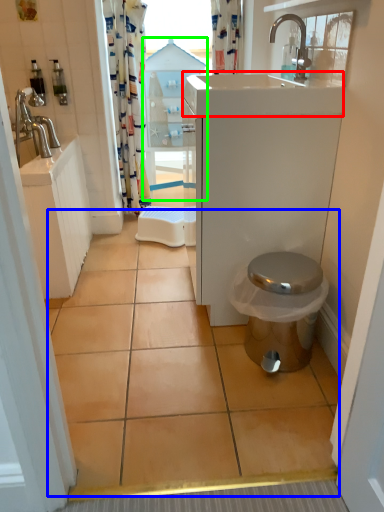
Question: Which is farther away from counter top (highlighted by a red box)? ceramic tile (highlighted by a blue box) or glass door (highlighted by a green box)?

Choices:
 (A) ceramic tile
 (B) glass door

Answer: (B)